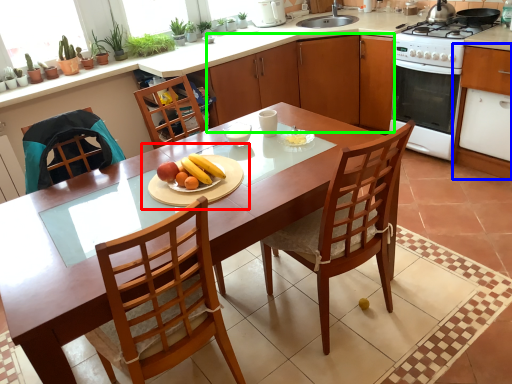
Question: Which is nearer to the fruit dish (highlighted by a red box)? cabinetry (highlighted by a blue box) or cabinetry (highlighted by a green box).

Choices:
 (A) cabinetry
 (B) cabinetry

Answer: (B)